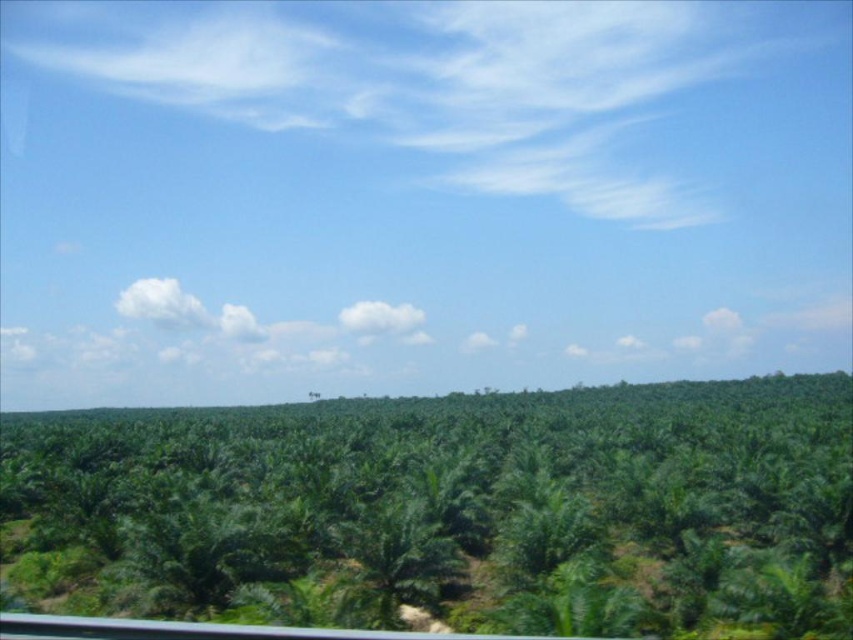
Question: From the image, what is the correct spatial relationship of green leafy jungle at center in relation to green leafy palm tree at center?

Choices:
 (A) right
 (B) left

Answer: (B)

Question: Considering the relative positions of green leafy jungle at center and green leafy palm tree at center in the image provided, where is green leafy jungle at center located with respect to green leafy palm tree at center?

Choices:
 (A) below
 (B) above

Answer: (A)

Question: Is the position of green leafy jungle at center less distant than that of green leafy palm tree at center?

Choices:
 (A) no
 (B) yes

Answer: (B)